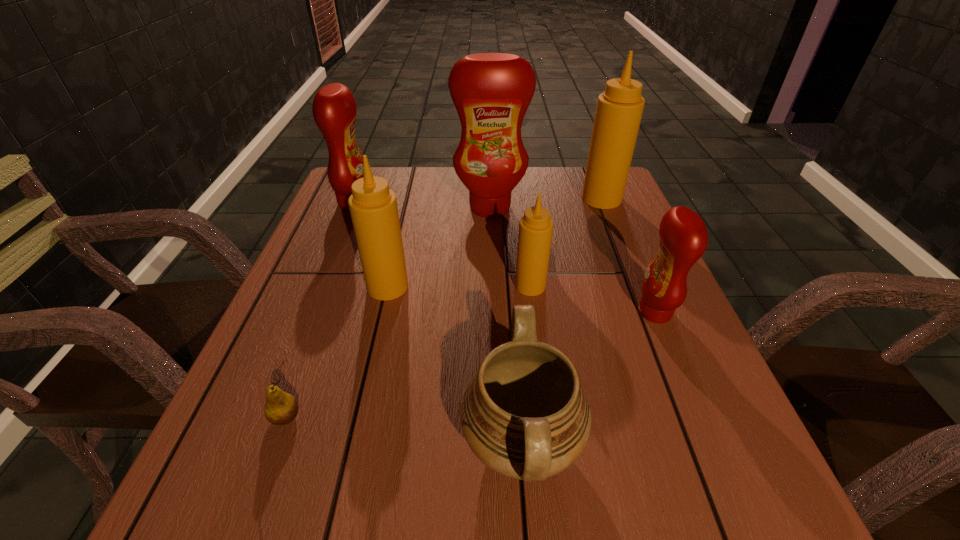
The height and width of the screenshot is (540, 960). What are the coordinates of `vacant space that is in between the urn and the nearest red condiment` in the screenshot? It's located at (588, 378).

I want to click on free area in between the rightmost red condiment and the smallest tan condiment, so click(592, 299).

This screenshot has width=960, height=540. I want to click on free space between the shortest object and the urn, so click(403, 430).

Identify which object is the seventh nearest to the second red condiment from left to right. Please provide its 2D coordinates. Your answer should be formatted as a tuple, i.e. [(x, y)], where the tuple contains the x and y coordinates of a point satisfying the conditions above.

[(281, 408)]

Identify which object is the second closest to the second tan condiment from left to right. Please provide its 2D coordinates. Your answer should be formatted as a tuple, i.e. [(x, y)], where the tuple contains the x and y coordinates of a point satisfying the conditions above.

[(524, 414)]

Locate an element on the screen. The height and width of the screenshot is (540, 960). condiment that is the third closest to the leftmost red condiment is located at coordinates (536, 227).

The height and width of the screenshot is (540, 960). I want to click on the second closest condiment relative to the leftmost red condiment, so click(373, 207).

You are a GUI agent. You are given a task and a screenshot of the screen. Output one action in this format:
    pyautogui.click(x=<x>, y=<y>)
    Task: Click on the second closest red condiment to the second tan condiment from right to left
    This screenshot has height=540, width=960.
    Given the screenshot: What is the action you would take?
    pyautogui.click(x=491, y=92)

I want to click on red condiment identified as the closest to the leftmost condiment, so click(x=491, y=92).

Where is `the closest tan condiment relative to the second smallest red condiment`? The height and width of the screenshot is (540, 960). the closest tan condiment relative to the second smallest red condiment is located at coordinates (373, 207).